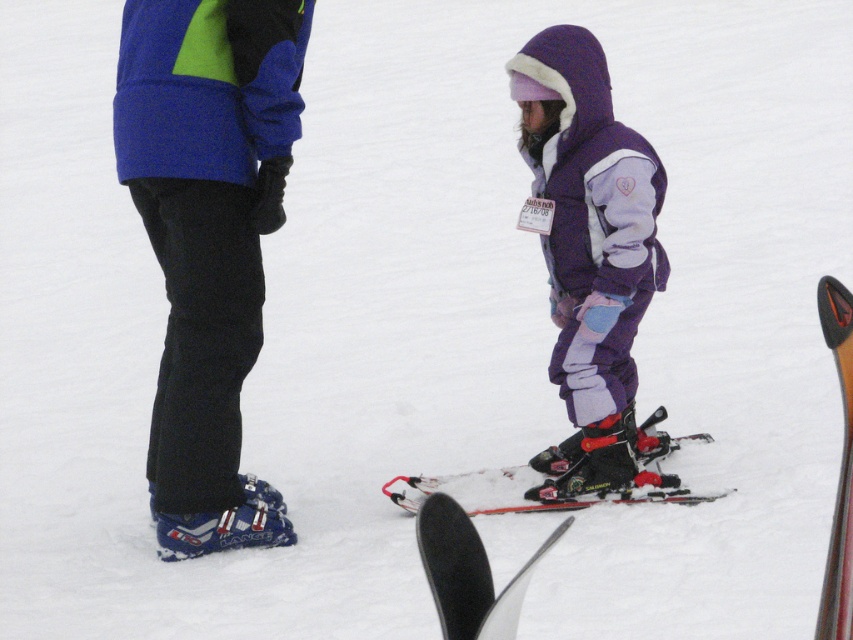
Between blue matte ski boots at lower left and purple fleece jacket at center, which one has more height?

blue matte ski boots at lower left

Which is more to the right, blue matte ski boots at lower left or purple fleece jacket at center?

purple fleece jacket at center

Does point (143, 52) lie in front of point (552, 40)?

That is True.

Image resolution: width=853 pixels, height=640 pixels. In order to click on blue matte ski boots at lower left in this screenshot , I will do `click(207, 240)`.

Is red matte skis at center shorter than shiny black ski at lower right?

Yes.

Is red matte skis at center above shiny black ski at lower right?

No.

Identify the location of red matte skis at center. (523, 492).

Is purple fleece jacket at center behind shiny black ski at lower right?

Yes, it is.

Measure the distance between point (537, 120) and camera.

The distance of point (537, 120) from camera is 5.63 meters.

Is point (584, 241) farther from viewer compared to point (840, 304)?

Yes, point (584, 241) is farther from viewer.

Where is `purple fleece jacket at center`? The height and width of the screenshot is (640, 853). purple fleece jacket at center is located at coordinates (592, 250).